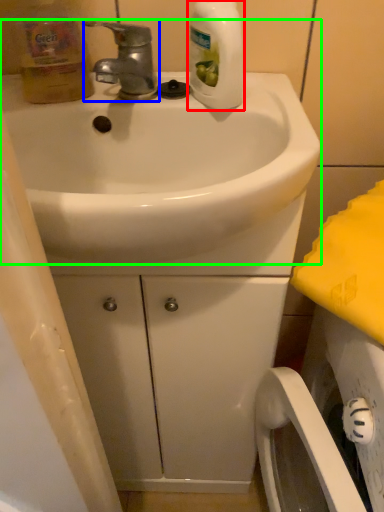
Question: Considering the real-world distances, which object is closest to cleaning product (highlighted by a red box)? tap (highlighted by a blue box) or sink (highlighted by a green box).

Choices:
 (A) tap
 (B) sink

Answer: (A)